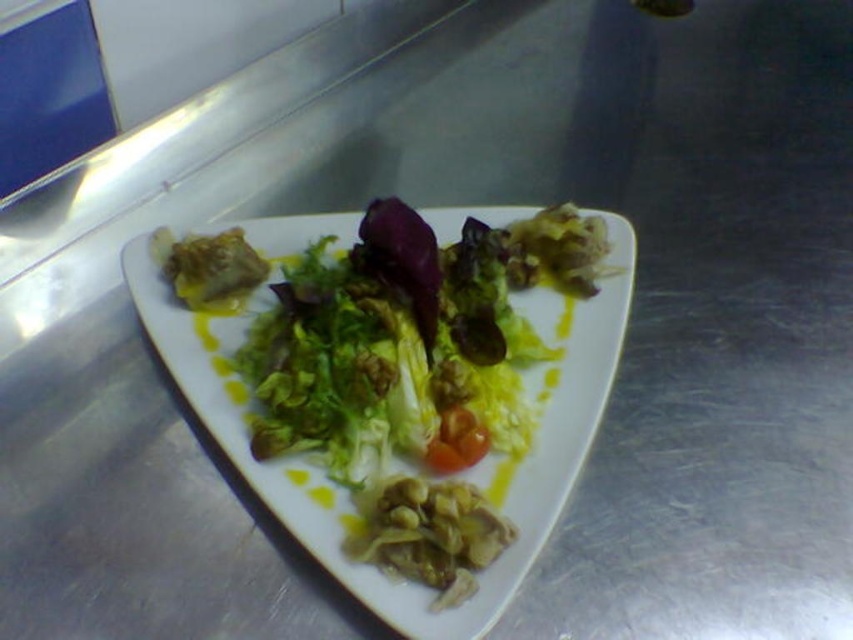
Question: Which point is farther from the camera taking this photo?

Choices:
 (A) (187, 376)
 (B) (474, 456)

Answer: (A)

Question: Among these objects, which one is farthest from the camera?

Choices:
 (A) white glossy platter at center
 (B) glossy red tomato at center

Answer: (B)

Question: Observing the image, what is the correct spatial positioning of white glossy platter at center in reference to glossy red tomato at center?

Choices:
 (A) right
 (B) left

Answer: (B)

Question: Is white glossy platter at center closer to camera compared to glossy red tomato at center?

Choices:
 (A) yes
 (B) no

Answer: (A)

Question: Does white glossy platter at center have a larger size compared to glossy red tomato at center?

Choices:
 (A) yes
 (B) no

Answer: (A)